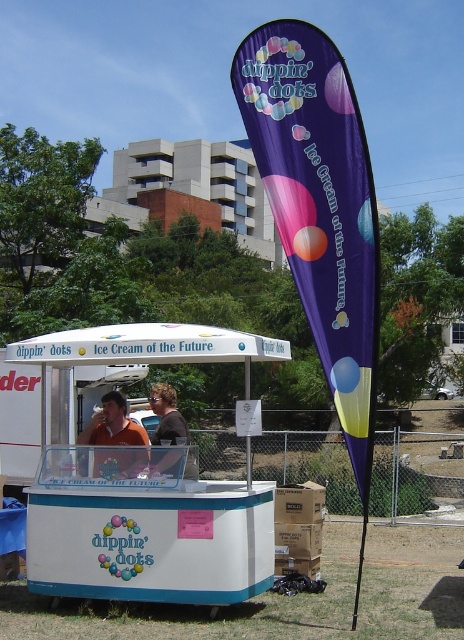
You are standing in front of the Dippin Dots ice cream stand and want to take a photo. You notice two points marked on the ground at coordinates point [162,349] and point [126,417]. Which point is closer to you?

Point [162,349] is closer to the camera than point [126,417], so the point closer to you is point [162,349].

You are standing in front of the Dippin Dots ice cream stand and see two points marked on the ground. The first point is at coordinates point (172, 586) and the second point is at point (167, 422). Which point is closer to you?

Point (172, 586) is closer to the viewer than point (167, 422).